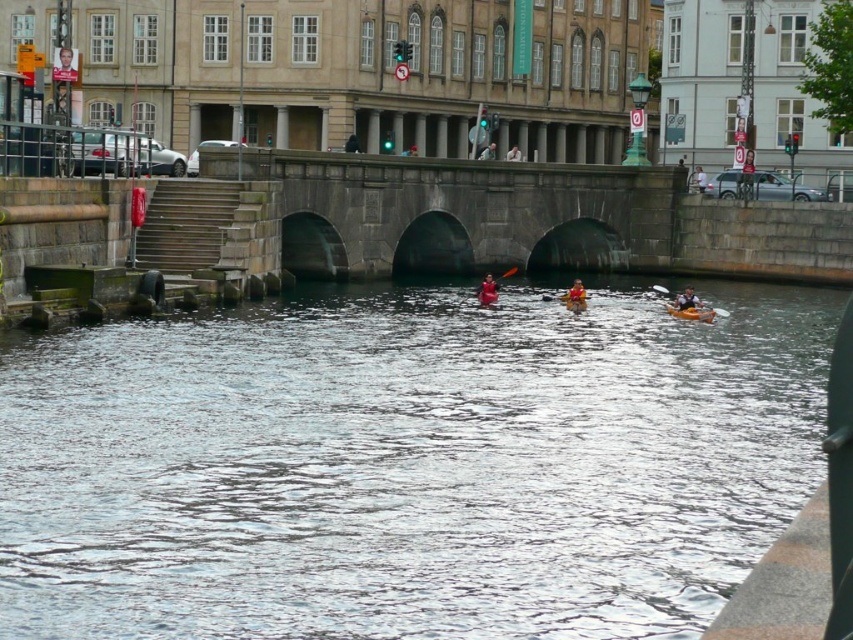
Can you confirm if light blue fabric at center is positioned below smooth white shirt at center?

Actually, light blue fabric at center is above smooth white shirt at center.

Does light blue fabric at center appear on the left side of smooth white shirt at center?

Yes, light blue fabric at center is to the left of smooth white shirt at center.

You are a GUI agent. You are given a task and a screenshot of the screen. Output one action in this format:
    pyautogui.click(x=<x>, y=<y>)
    Task: Click on the light blue fabric at center
    
    Given the screenshot: What is the action you would take?
    pyautogui.click(x=486, y=150)

Who is positioned more to the right, smooth skin face at center or orange plastic canoe at lower right?

Positioned to the right is orange plastic canoe at lower right.

Between smooth skin face at center and orange plastic canoe at lower right, which one is positioned lower?

orange plastic canoe at lower right

Locate an element on the screen. The image size is (853, 640). smooth skin face at center is located at coordinates (65, 65).

Is smooth skin face at center wider than light blue fabric at center?

Indeed, smooth skin face at center has a greater width compared to light blue fabric at center.

The image size is (853, 640). I want to click on smooth skin face at center, so click(x=65, y=65).

Does point (68, 68) lie behind point (485, 152)?

No, it is not.

Image resolution: width=853 pixels, height=640 pixels. What are the coordinates of `smooth skin face at center` in the screenshot? It's located at (65, 65).